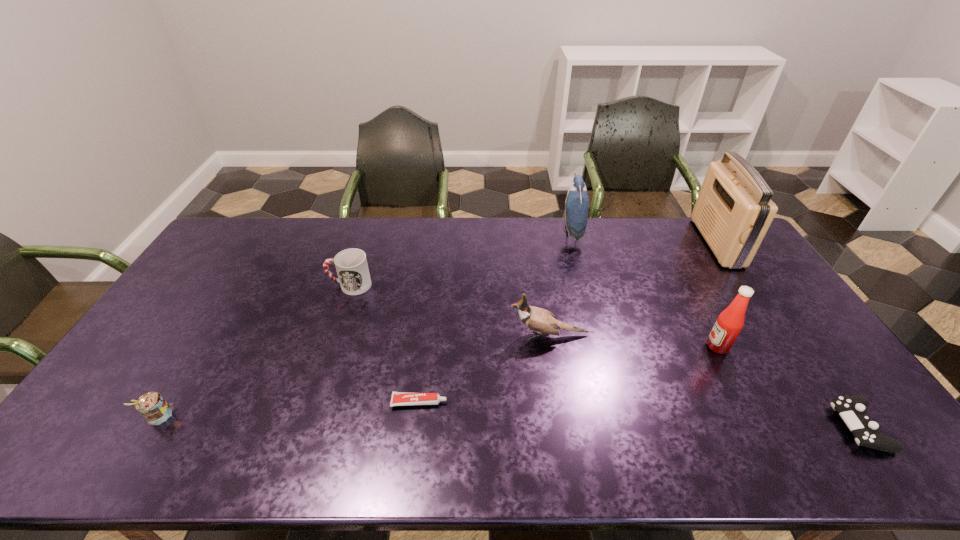
Where is `free space between the taller bird and the third object from right to left`? free space between the taller bird and the third object from right to left is located at coordinates (645, 289).

Where is `free space between the seventh tallest object and the condiment`? The image size is (960, 540). free space between the seventh tallest object and the condiment is located at coordinates click(x=789, y=387).

Find the location of `empty space between the radio receiver and the sixth object from left to right`. empty space between the radio receiver and the sixth object from left to right is located at coordinates (717, 294).

At what (x,y) coordinates should I click in order to perform the action: click on free point between the taller bird and the radio receiver. Please return your answer as a coordinate pair (x, y). The width and height of the screenshot is (960, 540). Looking at the image, I should click on (644, 237).

At what (x,y) coordinates should I click in order to perform the action: click on free area in between the fourth tallest object and the third shortest object. Please return your answer as a coordinate pair (x, y). The width and height of the screenshot is (960, 540). Looking at the image, I should click on (353, 376).

The image size is (960, 540). I want to click on free space between the fourth tallest object and the tallest object, so click(633, 288).

Identify which object is the fourth closest to the leftmost object. Please provide its 2D coordinates. Your answer should be formatted as a tuple, i.e. [(x, y)], where the tuple contains the x and y coordinates of a point satisfying the conditions above.

[(577, 201)]

Select which object appears as the fifth closest to the radio receiver. Please provide its 2D coordinates. Your answer should be formatted as a tuple, i.e. [(x, y)], where the tuple contains the x and y coordinates of a point satisfying the conditions above.

[(398, 398)]